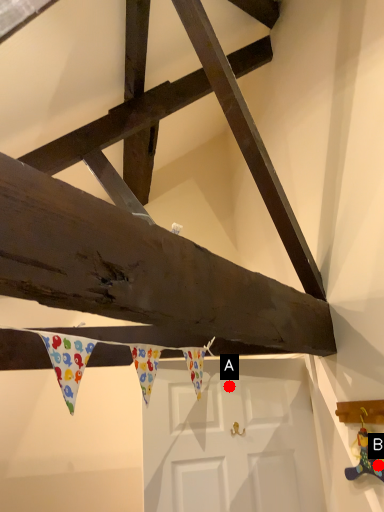
Question: Two points are circled on the image, labeled by A and B beside each circle. Which point is closer to the camera taking this photo?

Choices:
 (A) A is closer
 (B) B is closer

Answer: (B)